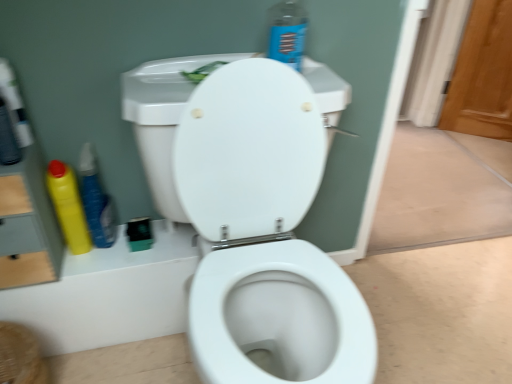
Image resolution: width=512 pixels, height=384 pixels. I want to click on free space to the right of yellow plastic bottle at left, the 1th cleaning product in the left-to-right sequence, so point(139,252).